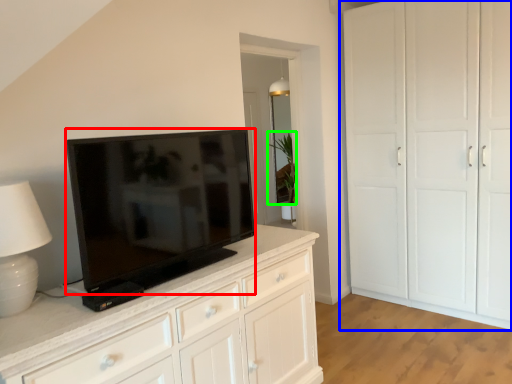
Question: Which object is positioned closest to television (highlighted by a red box)? Select from cupboard (highlighted by a blue box) and plant (highlighted by a green box).

Choices:
 (A) cupboard
 (B) plant

Answer: (A)